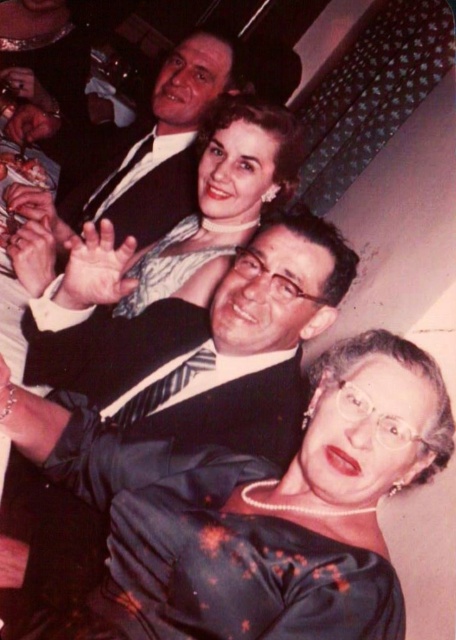
Question: Among these objects, which one is farthest from the camera?

Choices:
 (A) shiny black suit at center
 (B) sparkly silver dress at center
 (C) matte black suit at upper center
 (D) silky black dress at center

Answer: (C)

Question: Does matte black suit at upper center come in front of sparkly silver dress at center?

Choices:
 (A) yes
 (B) no

Answer: (B)

Question: Which object is the closest to the matte black suit at upper center?

Choices:
 (A) silky black dress at center
 (B) sparkly silver dress at center

Answer: (B)

Question: Is shiny black suit at center above matte black suit at upper center?

Choices:
 (A) yes
 (B) no

Answer: (B)

Question: Does matte black suit at upper center appear under sparkly silver dress at center?

Choices:
 (A) no
 (B) yes

Answer: (A)

Question: Estimate the real-world distances between objects in this image. Which object is farther from the shiny black suit at center?

Choices:
 (A) matte black suit at upper center
 (B) sparkly silver dress at center

Answer: (A)